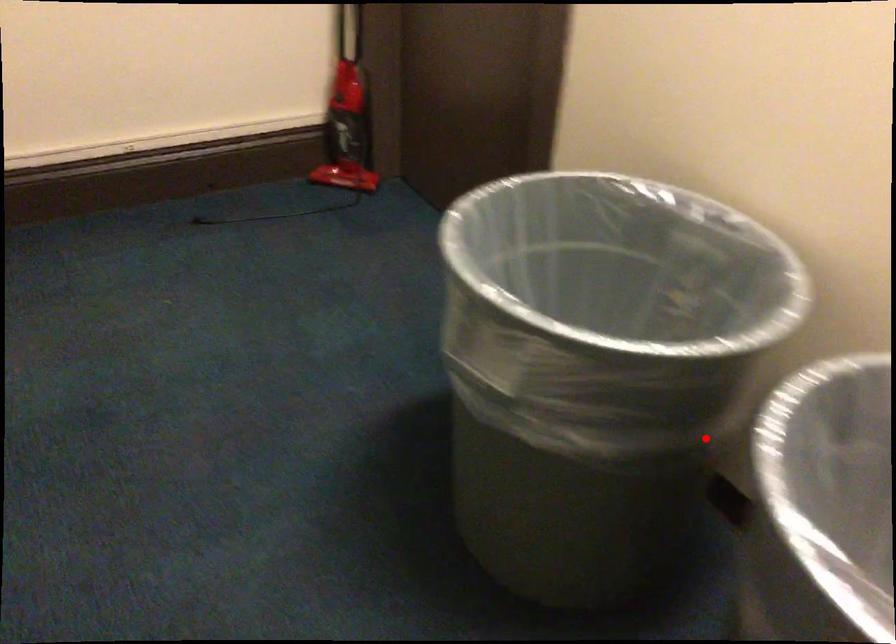
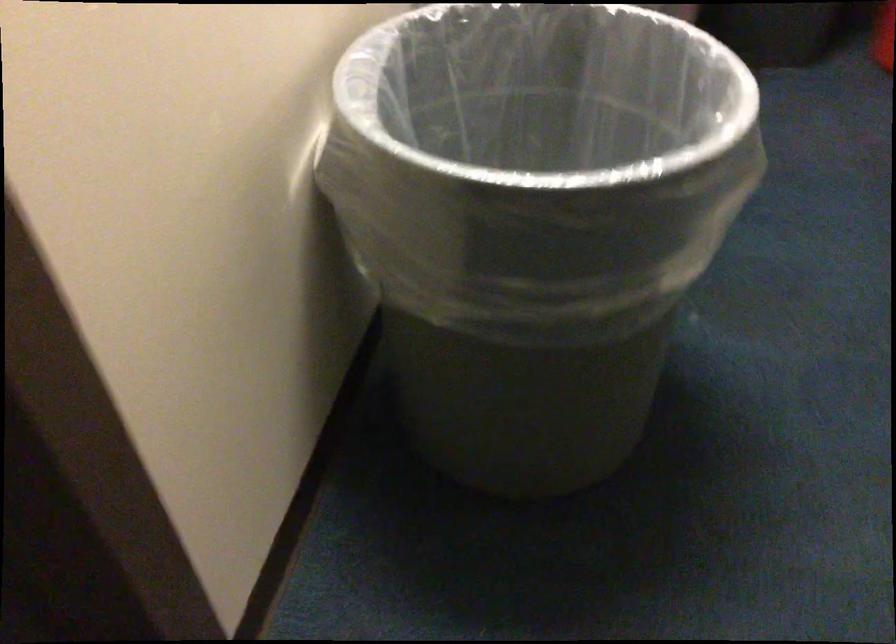
Where in the second image is the point corresponding to the highlighted location from the first image?

(538, 136)